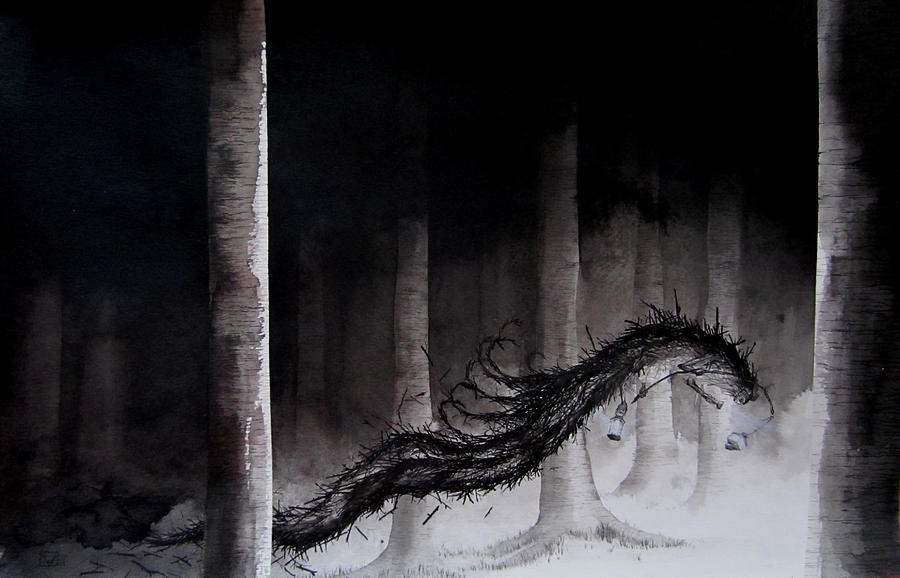
Where is `left side light`? left side light is located at coordinates (734, 437).